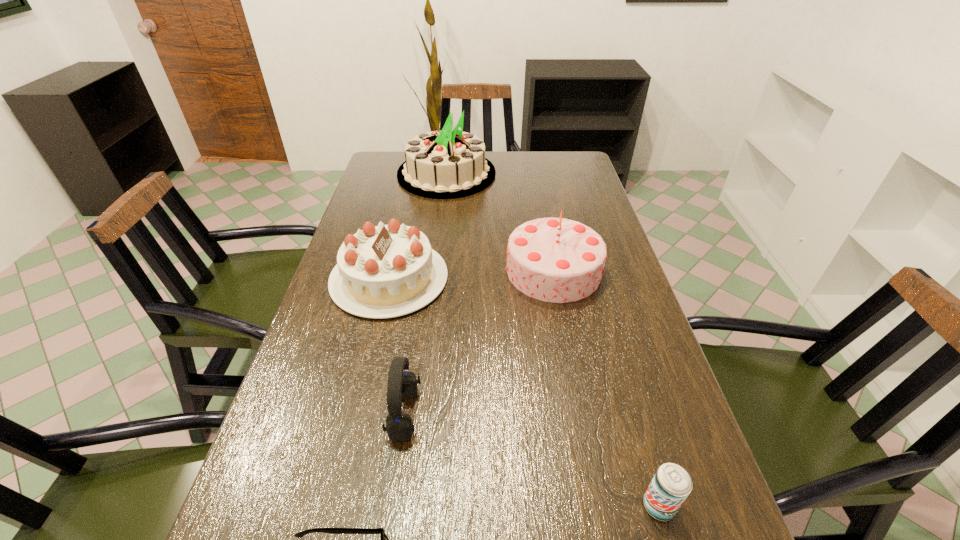
Where is `free point between the shortest birthday cake and the second shortest object`? free point between the shortest birthday cake and the second shortest object is located at coordinates (524, 392).

At what (x,y) coordinates should I click in order to perform the action: click on vacant space that's between the rightmost birthday cake and the shortest birthday cake. Please return your answer as a coordinate pair (x, y). Image resolution: width=960 pixels, height=540 pixels. Looking at the image, I should click on (471, 274).

Locate an element on the screen. This screenshot has height=540, width=960. vacant point located between the farthest birthday cake and the shortest birthday cake is located at coordinates point(418,226).

Where is `vacant space that is in between the shortest birthday cake and the fifth farthest object`? The image size is (960, 540). vacant space that is in between the shortest birthday cake and the fifth farthest object is located at coordinates (524, 392).

You are a GUI agent. You are given a task and a screenshot of the screen. Output one action in this format:
    pyautogui.click(x=<x>, y=<y>)
    Task: Click on the vacant space that's between the beer can and the shortest birthday cake
    The image size is (960, 540).
    Given the screenshot: What is the action you would take?
    pyautogui.click(x=524, y=392)

Where is `object that is the fifth closest to the farthest birthday cake`? This screenshot has width=960, height=540. object that is the fifth closest to the farthest birthday cake is located at coordinates (384, 539).

Image resolution: width=960 pixels, height=540 pixels. Find the location of `object that is the third nearest to the shortest birthday cake`. object that is the third nearest to the shortest birthday cake is located at coordinates (444, 164).

Locate which birthday cake is the closest to the farthest birthday cake. Please provide its 2D coordinates. Your answer should be formatted as a tuple, i.e. [(x, y)], where the tuple contains the x and y coordinates of a point satisfying the conditions above.

[(559, 260)]

Identify which birthday cake is the nearest to the farthest object. Please provide its 2D coordinates. Your answer should be formatted as a tuple, i.e. [(x, y)], where the tuple contains the x and y coordinates of a point satisfying the conditions above.

[(559, 260)]

Locate an element on the screen. The width and height of the screenshot is (960, 540). free space that satisfies the following two spatial constraints: 1. on the front side of the fifth tallest object; 2. on the left side of the rightmost birthday cake is located at coordinates (600, 506).